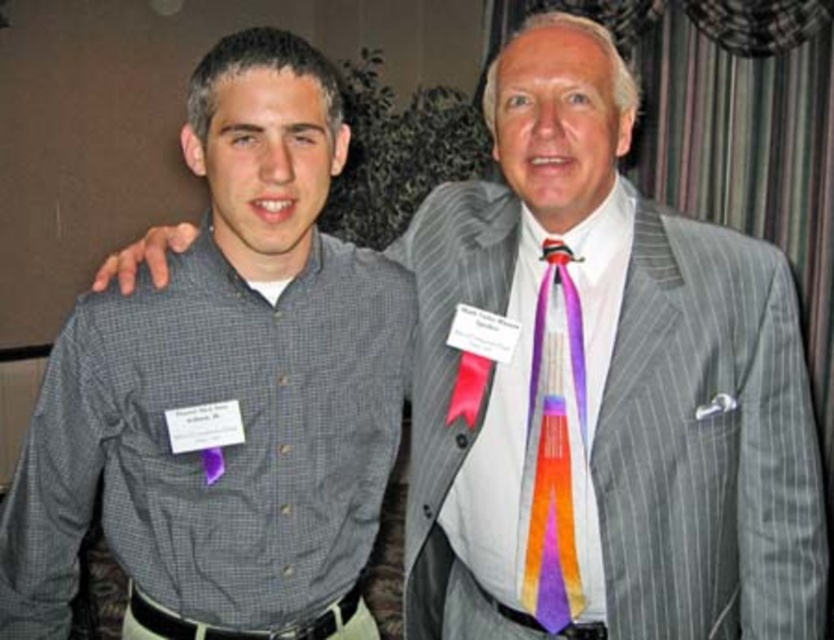
Is gray checkered shirt at left wider than gray pinstripe suit at right?

In fact, gray checkered shirt at left might be narrower than gray pinstripe suit at right.

Which is more to the left, gray checkered shirt at left or gray pinstripe suit at right?

From the viewer's perspective, gray checkered shirt at left appears more on the left side.

Is point (300, 268) closer to viewer compared to point (800, 497)?

Yes, point (300, 268) is closer to viewer.

Locate an element on the screen. The width and height of the screenshot is (834, 640). gray checkered shirt at left is located at coordinates (225, 390).

Is gray checkered shirt at left below multicolored silk tie at center?

Incorrect, gray checkered shirt at left is not positioned below multicolored silk tie at center.

Does point (255, 465) come behind point (546, 589)?

No, (255, 465) is in front of (546, 589).

Is point (244, 365) positioned after point (543, 307)?

No, it is not.

Identify the location of gray checkered shirt at left. This screenshot has width=834, height=640. (225, 390).

How much distance is there between gray pinstripe suit at right and multicolored silk tie at center?

They are 6.74 inches apart.

Can you confirm if gray pinstripe suit at right is positioned to the left of multicolored silk tie at center?

Incorrect, gray pinstripe suit at right is not on the left side of multicolored silk tie at center.

Between point (706, 326) and point (551, 632), which one is positioned in front?

Point (706, 326)

Where is `gray pinstripe suit at right`? gray pinstripe suit at right is located at coordinates (707, 444).